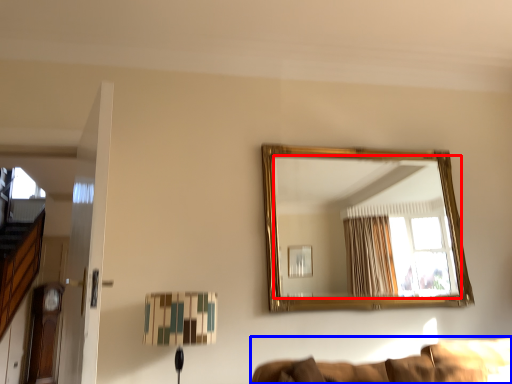
Question: Which of the following is the farthest to the observer, mirror (highlighted by a red box) or couch (highlighted by a blue box)?

Choices:
 (A) mirror
 (B) couch

Answer: (A)